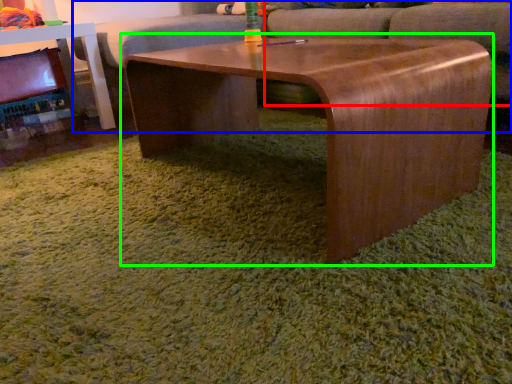
Question: Which object is the farthest from swivel chair (highlighted by a red box)? Choose among these: couch (highlighted by a blue box) or coffee table (highlighted by a green box).

Choices:
 (A) couch
 (B) coffee table

Answer: (B)